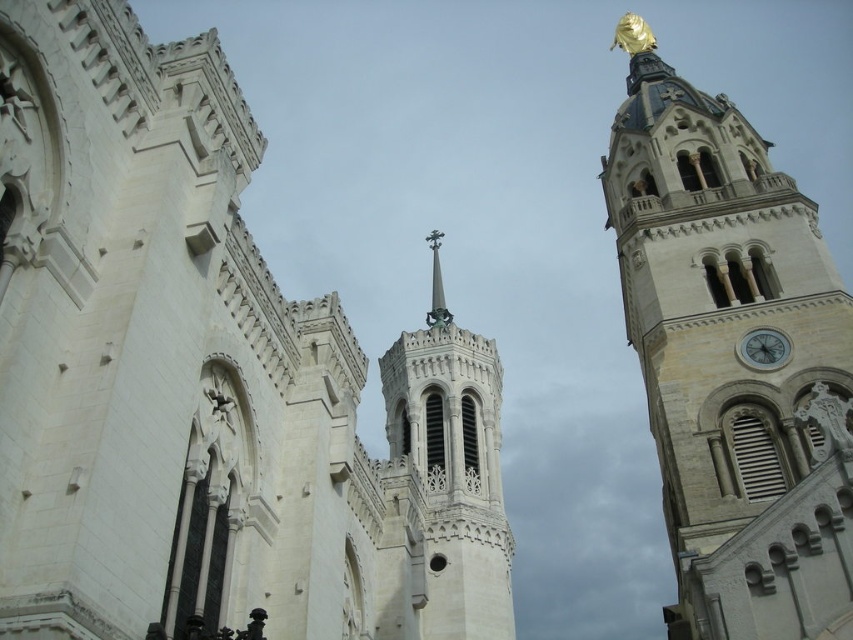
You are standing in front of the cathedral and notice two points marked on the central tower. The first point is located at coordinates point (210, 340) and the second at point (387, 392). Which of these points is nearer to your current position?

Point (210, 340) is closer to the camera than point (387, 392), so the first point is nearer to your current position.

Based on the scene description, which object is located higher up in the image between the white stone church at center and the white stone spire at center?

The white stone church at center is positioned over the white stone spire at center, so the church is higher up in the image.

You are an architect visiting the cathedral and want to take a photo of the golden statue at upper right and the white stone clock at right. Which object will appear closer to the camera in your photo?

The golden statue at upper right will appear closer to the camera in the photo because it is positioned in front of the white stone clock at right.